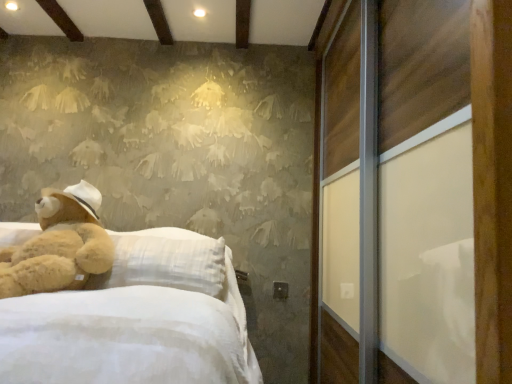
Question: Is soft brown plush at left taller or shorter than wooden sliding door at right?

Choices:
 (A) short
 (B) tall

Answer: (A)

Question: Which is correct: soft brown plush at left is inside wooden sliding door at right, or outside of it?

Choices:
 (A) inside
 (B) outside

Answer: (B)

Question: From a real-world perspective, relative to wooden sliding door at right, is soft brown plush at left vertically above or below?

Choices:
 (A) above
 (B) below

Answer: (B)

Question: Considering the positions of wooden sliding door at right and soft brown plush at left in the image, is wooden sliding door at right wider or thinner than soft brown plush at left?

Choices:
 (A) thin
 (B) wide

Answer: (B)

Question: From a real-world perspective, relative to soft brown plush at left, is wooden sliding door at right vertically above or below?

Choices:
 (A) above
 (B) below

Answer: (A)

Question: Considering the relative positions of wooden sliding door at right and soft brown plush at left in the image provided, is wooden sliding door at right to the left or to the right of soft brown plush at left?

Choices:
 (A) right
 (B) left

Answer: (A)

Question: From the image's perspective, is wooden sliding door at right located above or below soft brown plush at left?

Choices:
 (A) below
 (B) above

Answer: (B)